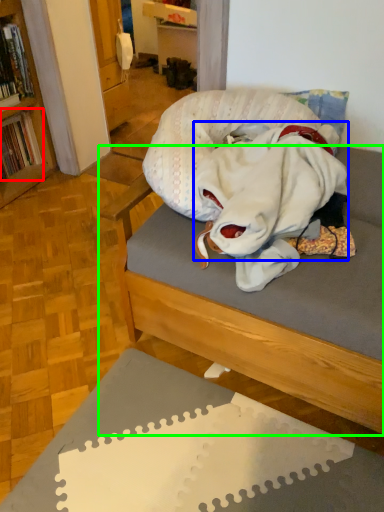
Question: Estimate the real-world distances between objects in this image. Which object is closer to book (highlighted by a red box), clothing (highlighted by a blue box) or studio couch (highlighted by a green box)?

Choices:
 (A) clothing
 (B) studio couch

Answer: (A)